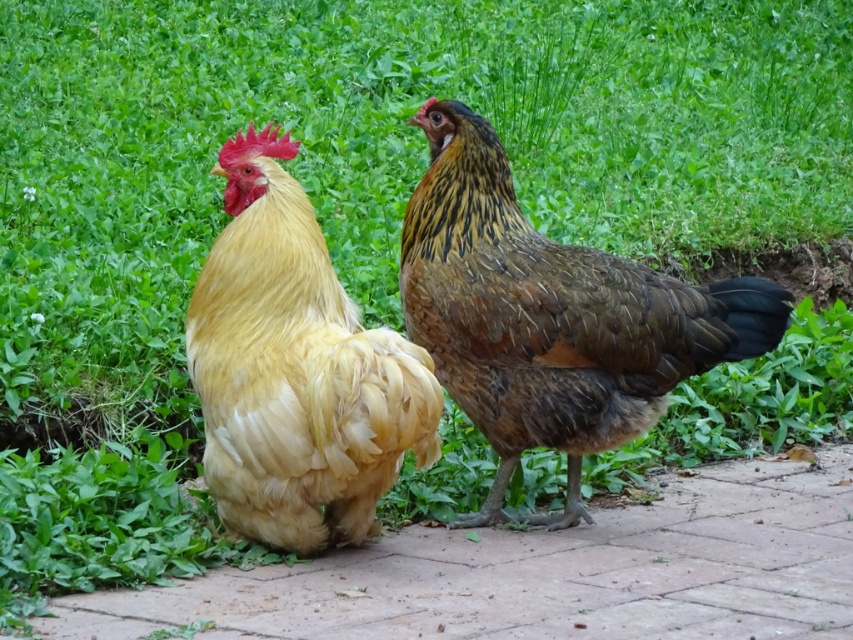
You are a drone operator trying to capture aerial footage of two chickens on a paved area. You need to ensure that both points, point (634,534) and point (492,426), are visible in your shot. Based on their positions, which point is closer to the camera?

Point (492,426) is closer to the camera because point (634,534) is behind it.

You are a small toy car that is 10 cm tall. You want to drive over the brick pavement at lower center to reach the brown speckled feathered chicken at center. Can you safely pass under the chicken without hitting your roof?

The brick pavement at lower center is not as tall as the brown speckled feathered chicken at center, so the toy car can safely pass under the chicken without hitting its roof since the pavement is shorter than the chicken.